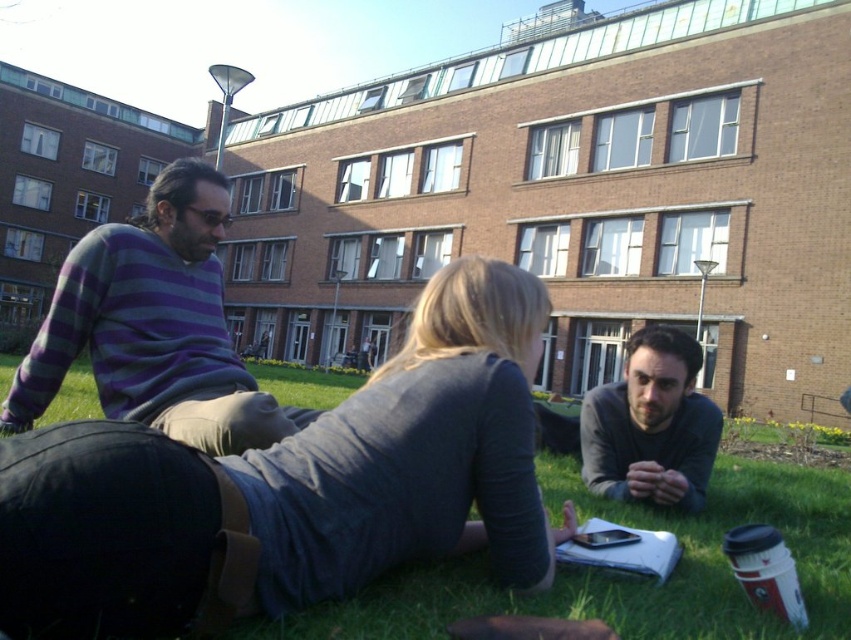
Is dark gray sweater at center thinner than smooth gray shirt at center?

No.

Between point (112, 547) and point (627, 364), which one is positioned in front?

Point (112, 547) is more forward.

Where is `dark gray sweater at center`? Image resolution: width=851 pixels, height=640 pixels. dark gray sweater at center is located at coordinates (292, 486).

Can you confirm if dark gray sweater at center is thinner than striped sweater at left?

Yes.

Does dark gray sweater at center have a lesser height compared to striped sweater at left?

Indeed, dark gray sweater at center has a lesser height compared to striped sweater at left.

Is point (204, 616) farther from viewer compared to point (193, 237)?

No, (204, 616) is in front of (193, 237).

The width and height of the screenshot is (851, 640). Identify the location of dark gray sweater at center. (292, 486).

Does striped sweater at left appear under smooth gray shirt at center?

→ No.

From the picture: Who is more forward, (86, 323) or (607, 394)?

Positioned in front is point (86, 323).

Is point (115, 243) farther from camera compared to point (597, 474)?

That is False.

You are a GUI agent. You are given a task and a screenshot of the screen. Output one action in this format:
    pyautogui.click(x=<x>, y=<y>)
    Task: Click on the striped sweater at left
    The width and height of the screenshot is (851, 640).
    Given the screenshot: What is the action you would take?
    pyautogui.click(x=153, y=324)